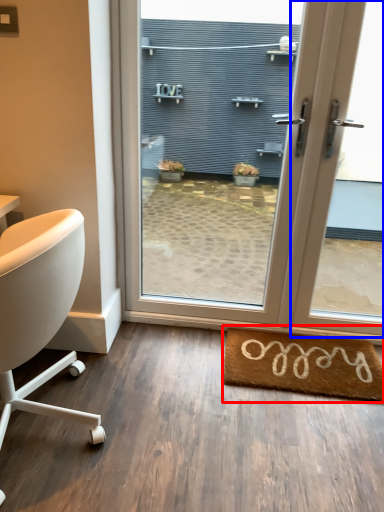
Question: Which object appears closest to the camera in this image, mat (highlighted by a red box) or window (highlighted by a blue box)?

Choices:
 (A) mat
 (B) window

Answer: (B)